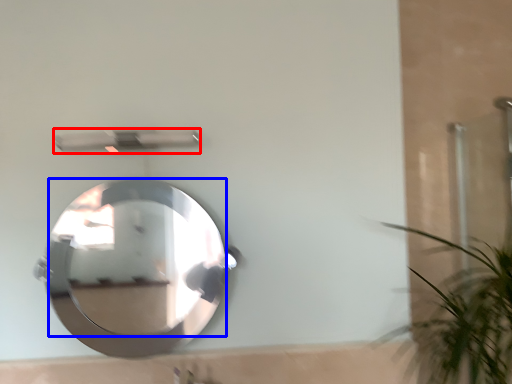
Question: Which point is further to the camera, shower (highlighted by a red box) or mirror (highlighted by a blue box)?

Choices:
 (A) shower
 (B) mirror

Answer: (A)